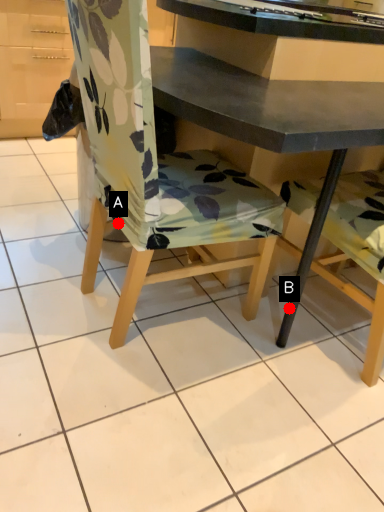
Question: Two points are circled on the image, labeled by A and B beside each circle. Which point is farther to the camera?

Choices:
 (A) A is further
 (B) B is further

Answer: (B)